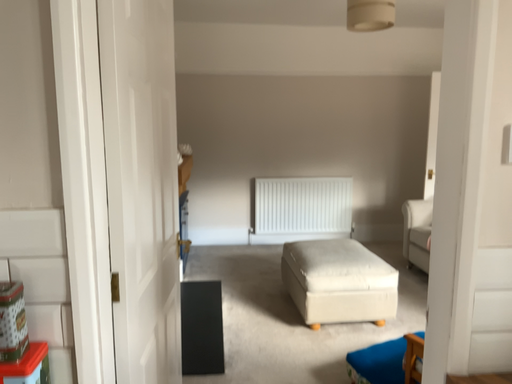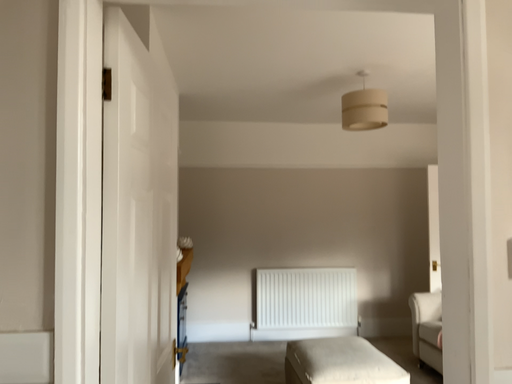
Question: How did the camera likely rotate when shooting the video?

Choices:
 (A) rotated upward
 (B) rotated downward

Answer: (A)